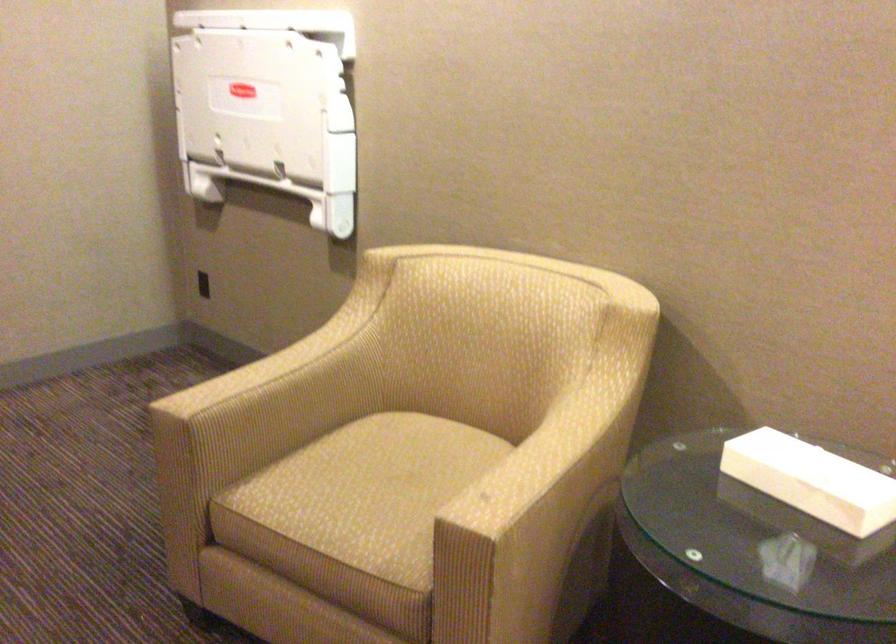
Find the location of a particular element. The height and width of the screenshot is (644, 896). chair sitting surface is located at coordinates (371, 491).